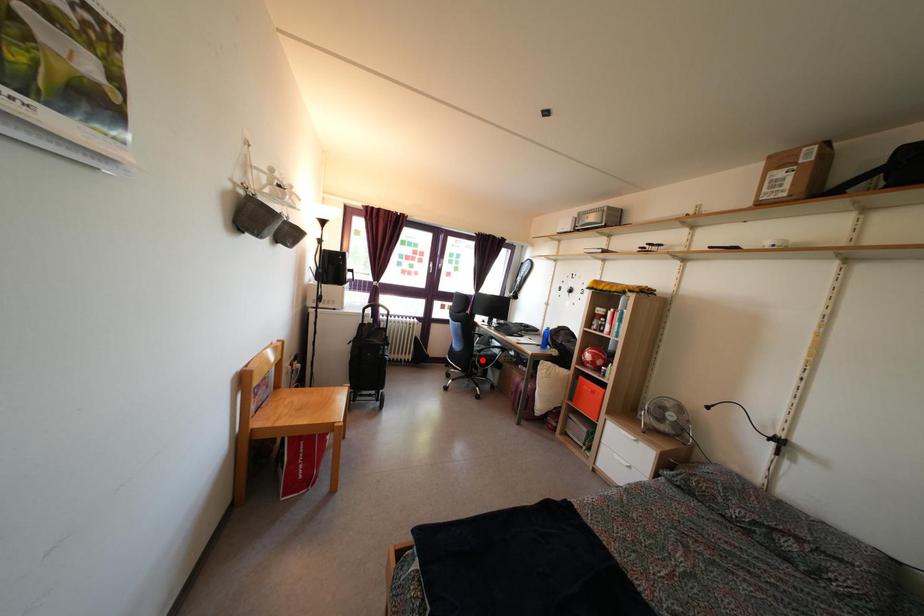
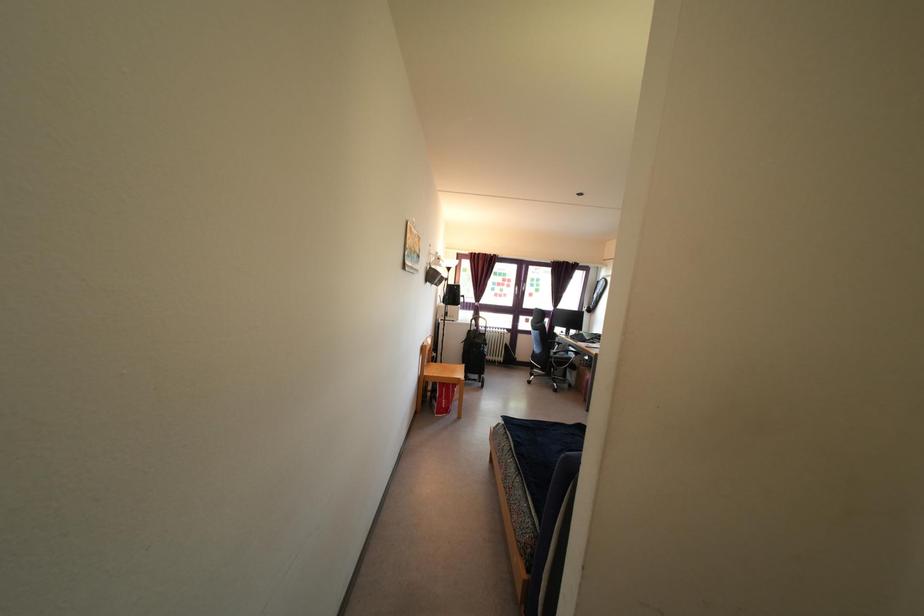
Question: I am providing you with two images of the same scene from different viewpoints. A red point is shown in image1. For the corresponding object point in image2, is it positioned nearer or farther from the camera?

Choices:
 (A) Nearer
 (B) Farther

Answer: (A)